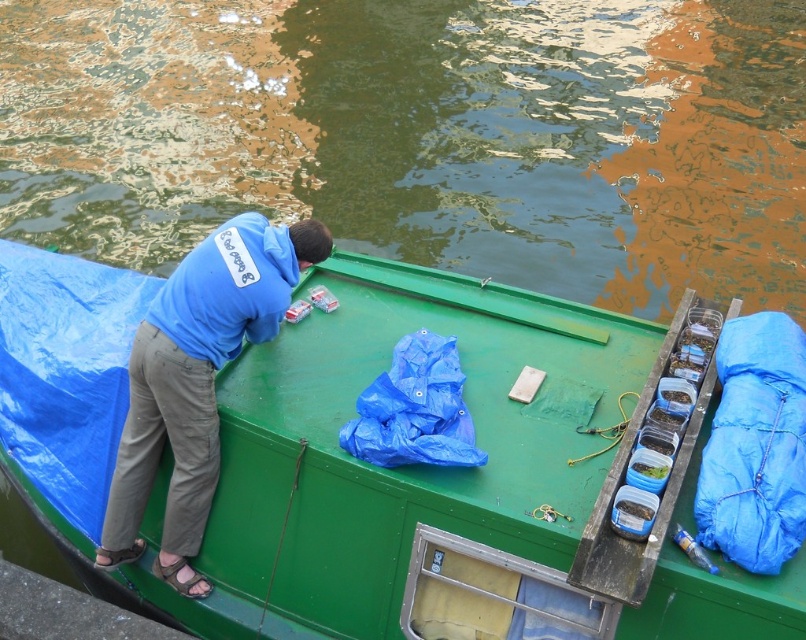
Question: Among these points, which one is farthest from the camera?

Choices:
 (A) (767, 188)
 (B) (136, 349)
 (C) (492, 330)

Answer: (A)

Question: In this image, where is green matte boat at center located relative to blue cotton hoodie at upper left?

Choices:
 (A) left
 (B) right

Answer: (B)

Question: Which of these objects is positioned closest to the green matte boat at center?

Choices:
 (A) green water at upper center
 (B) blue cotton hoodie at upper left

Answer: (B)

Question: Can you confirm if green water at upper center is positioned below blue cotton hoodie at upper left?

Choices:
 (A) yes
 (B) no

Answer: (B)

Question: Where is green water at upper center located in relation to blue cotton hoodie at upper left in the image?

Choices:
 (A) right
 (B) left

Answer: (A)

Question: Which of these objects is positioned closest to the green matte boat at center?

Choices:
 (A) green water at upper center
 (B) blue cotton hoodie at upper left

Answer: (B)